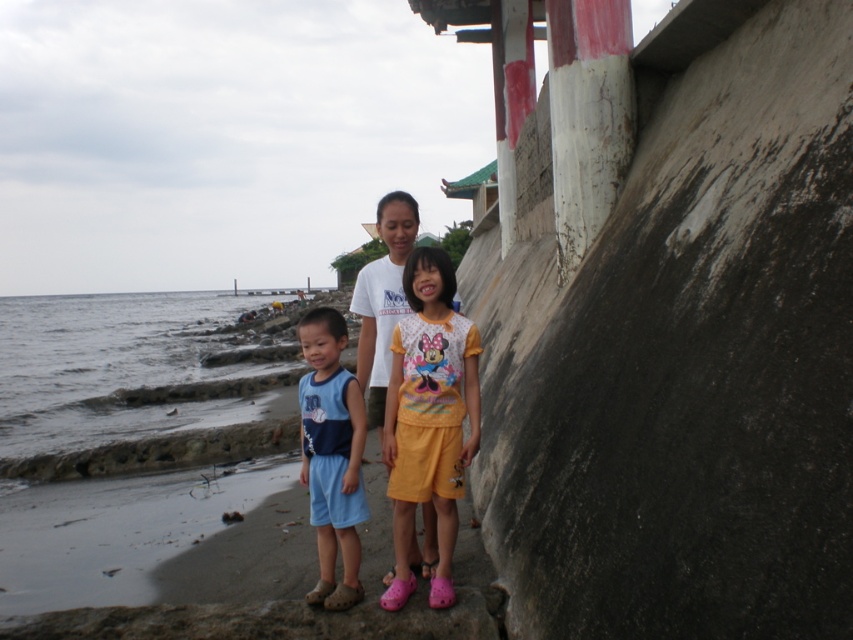
Question: Considering the relative positions of yellow cotton shorts at center and blue fabric shorts at center in the image provided, where is yellow cotton shorts at center located with respect to blue fabric shorts at center?

Choices:
 (A) left
 (B) right

Answer: (B)

Question: Is yellow cotton shorts at center to the left of blue fabric shorts at center from the viewer's perspective?

Choices:
 (A) no
 (B) yes

Answer: (A)

Question: Which of the following is the farthest from the observer?

Choices:
 (A) yellow cotton shorts at center
 (B) blue fabric shorts at center

Answer: (B)

Question: Is yellow cotton shorts at center behind blue fabric shorts at center?

Choices:
 (A) no
 (B) yes

Answer: (A)

Question: Among these points, which one is farthest from the camera?

Choices:
 (A) (332, 538)
 (B) (445, 550)

Answer: (A)